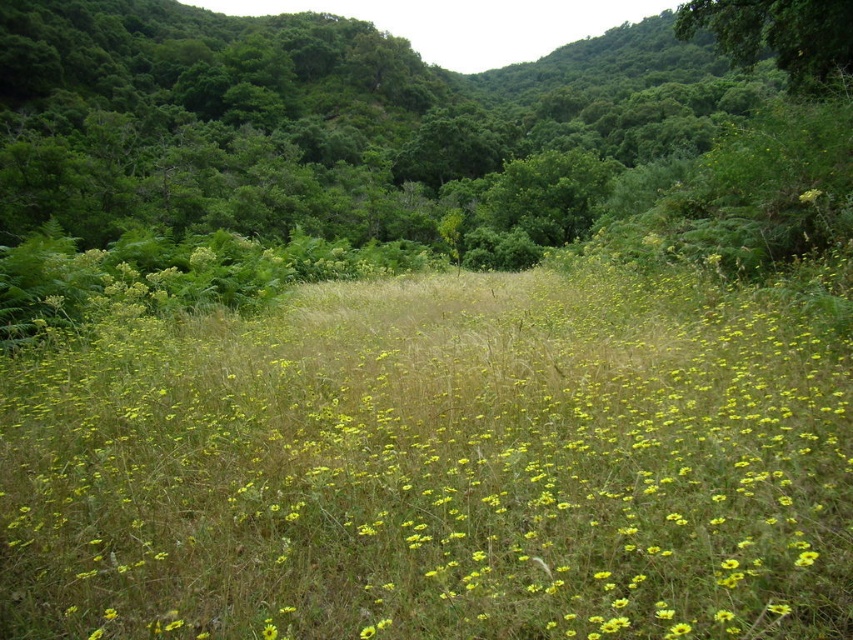
Can you confirm if green leafy tree at upper right is bigger than yellow matte flower at center?

Yes.

Image resolution: width=853 pixels, height=640 pixels. In order to click on green leafy tree at upper right in this screenshot , I will do `click(776, 35)`.

Can you confirm if yellow grass at center is positioned to the left of green leafy tree at upper right?

Indeed, yellow grass at center is positioned on the left side of green leafy tree at upper right.

At what (x,y) coordinates should I click in order to perform the action: click on yellow grass at center. Please return your answer as a coordinate pair (x, y). The image size is (853, 640). Looking at the image, I should click on 434,468.

Between point (200, 378) and point (798, 196), which one is positioned in front?

Positioned in front is point (200, 378).

From the picture: Who is more forward, (473, 531) or (817, 195)?

Point (473, 531) is more forward.

At what (x,y) coordinates should I click in order to perform the action: click on yellow grass at center. Please return your answer as a coordinate pair (x, y). Looking at the image, I should click on (434, 468).